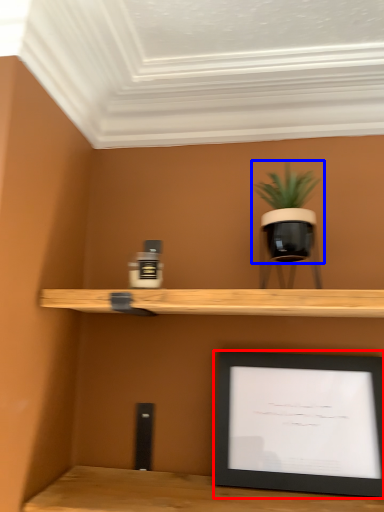
Question: Among these objects, which one is nearest to the camera, picture frame (highlighted by a red box) or houseplant (highlighted by a blue box)?

Choices:
 (A) picture frame
 (B) houseplant

Answer: (B)